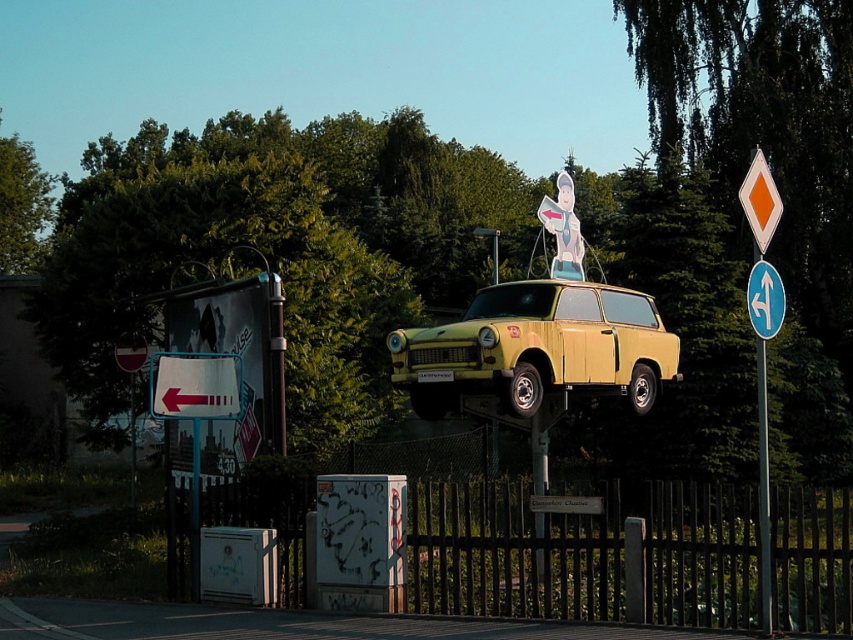
Where is `yellow matte car at center`? This screenshot has height=640, width=853. yellow matte car at center is located at coordinates (537, 348).

Is yellow matte car at center shorter than blue plastic arrow at upper center?

No.

Is point (456, 362) more distant than point (759, 288)?

Yes, point (456, 362) is behind point (759, 288).

At what (x,y) coordinates should I click in order to perform the action: click on yellow matte car at center. Please return your answer as a coordinate pair (x, y). Image resolution: width=853 pixels, height=640 pixels. Looking at the image, I should click on (537, 348).

Which is more to the left, white plastic sign at left or metallic gray utility box at lower left?

Positioned to the left is white plastic sign at left.

Between white plastic sign at left and metallic gray utility box at lower left, which one has more height?

metallic gray utility box at lower left

Is point (198, 356) closer to viewer compared to point (242, 557)?

No, it is behind (242, 557).

Find the location of a particular element. white plastic sign at left is located at coordinates (195, 385).

Image resolution: width=853 pixels, height=640 pixels. Describe the element at coordinates (583, 552) in the screenshot. I see `wooden fence at lower center` at that location.

Measure the distance from wooden fence at lower center to blue plastic arrow at upper center.

wooden fence at lower center and blue plastic arrow at upper center are 7.94 meters apart.

This screenshot has width=853, height=640. What do you see at coordinates (583, 552) in the screenshot? I see `wooden fence at lower center` at bounding box center [583, 552].

I want to click on wooden fence at lower center, so pos(583,552).